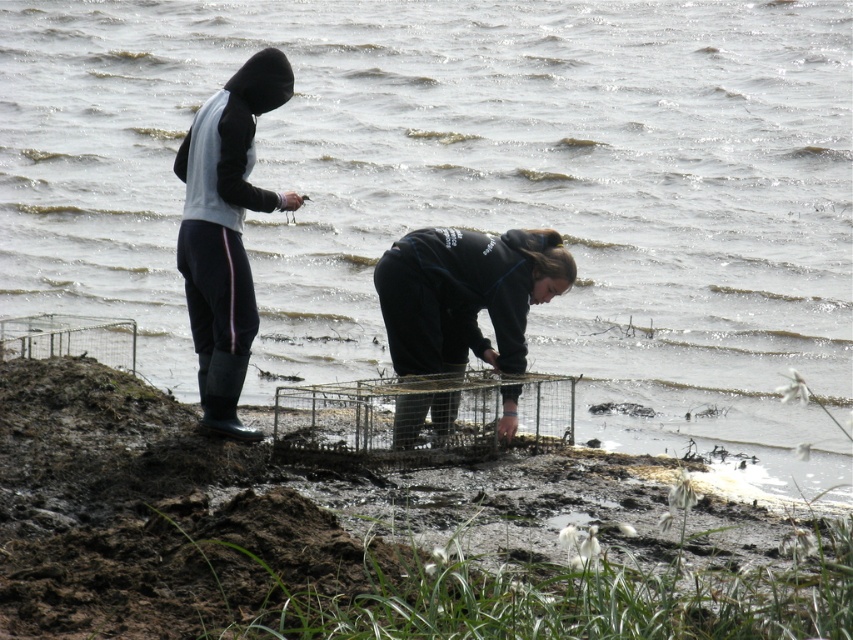
Question: Can you confirm if black matte jacket at lower center is positioned to the right of rubber boots at left?

Choices:
 (A) no
 (B) yes

Answer: (B)

Question: Which of these objects is positioned farthest from the rubber boots at left?

Choices:
 (A) black matte jacket at lower center
 (B) metallic wire birdcage at center

Answer: (A)

Question: Which object is positioned closest to the rubber boots at left?

Choices:
 (A) black matte jacket at lower center
 (B) metallic wire birdcage at center

Answer: (B)

Question: Does black matte jacket at lower center come behind rubber boots at left?

Choices:
 (A) yes
 (B) no

Answer: (A)

Question: Which point is farther to the camera?

Choices:
 (A) rubber boots at left
 (B) black matte jacket at lower center
 (C) metallic wire birdcage at center

Answer: (B)

Question: Can you confirm if black matte jacket at lower center is positioned below rubber boots at left?

Choices:
 (A) no
 (B) yes

Answer: (B)